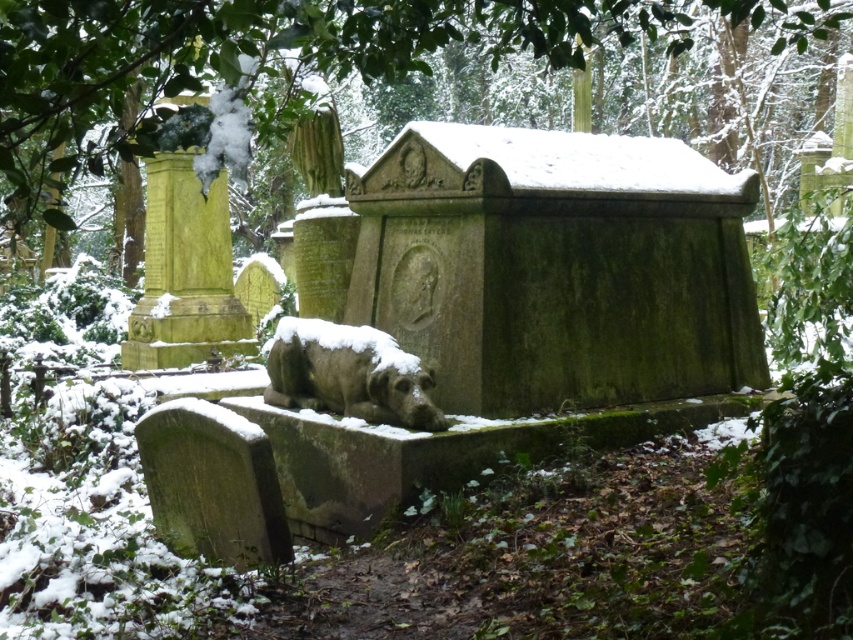
Looking at this image, can you confirm if green mossy tree at upper center is wider than slate gray stone dog at center?

Yes, green mossy tree at upper center is wider than slate gray stone dog at center.

Locate an element on the screen. green mossy tree at upper center is located at coordinates (248, 65).